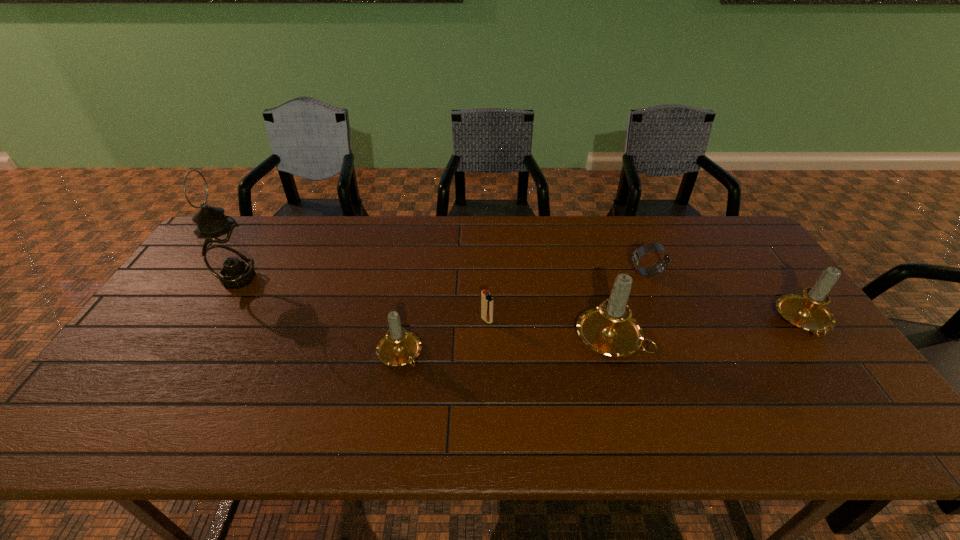
Identify which candle is the third closest to the oil lamp. Please provide its 2D coordinates. Your answer should be formatted as a tuple, i.e. [(x, y)], where the tuple contains the x and y coordinates of a point satisfying the conditions above.

[(807, 311)]

The image size is (960, 540). Identify the location of vacant area in the image that satisfies the following two spatial constraints: 1. on the front side of the tallest object; 2. on the left side of the rightmost object. (212, 322).

At what (x,y) coordinates should I click in order to perform the action: click on free space that satisfies the following two spatial constraints: 1. on the front side of the igniter; 2. on the right side of the fourth object from left to right. Please return your answer as a coordinate pair (x, y). Looking at the image, I should click on (488, 338).